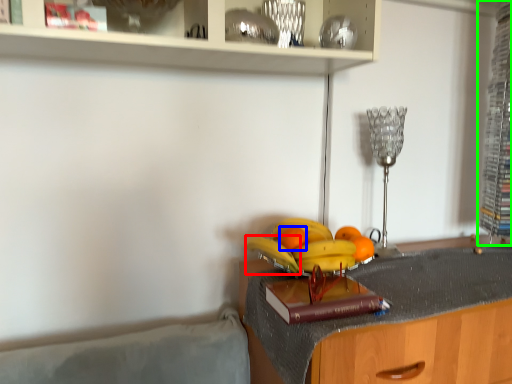
Question: Estimate the real-world distances between objects in this image. Which object is closer to banana (highlighted by a red box), orange (highlighted by a blue box) or cabinet (highlighted by a green box)?

Choices:
 (A) orange
 (B) cabinet

Answer: (A)